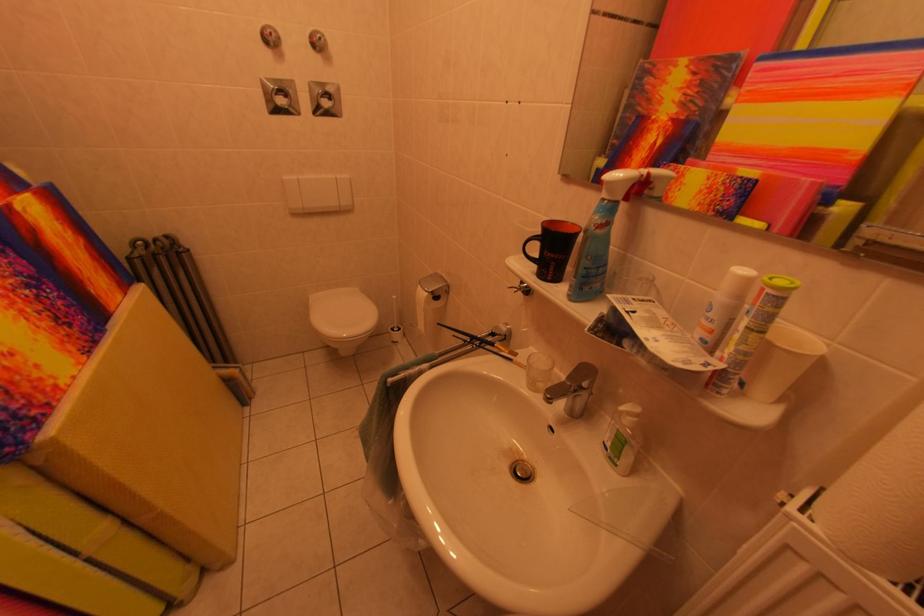
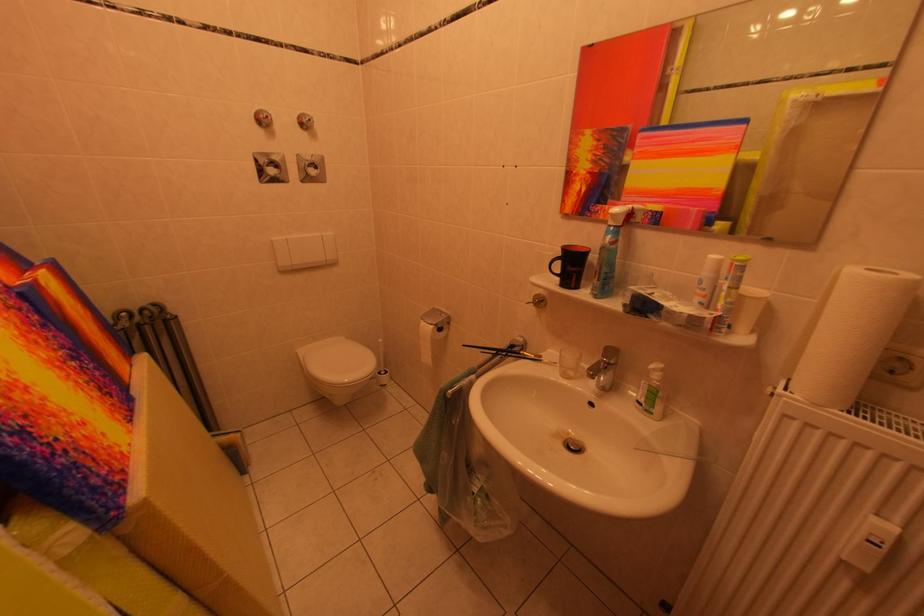
Question: The camera is either moving clockwise (left) or counter-clockwise (right) around the object. The first image is from the beginning of the video and the second image is from the end. Is the camera moving left or right when shooting the video?

Choices:
 (A) Left
 (B) Right

Answer: (A)